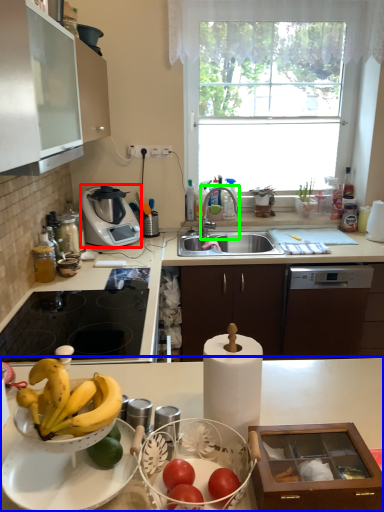
Question: Which object is positioned closest to kitchen appliance (highlighted by a red box)? Select from countertop (highlighted by a blue box) and tap (highlighted by a green box).

Choices:
 (A) countertop
 (B) tap

Answer: (B)